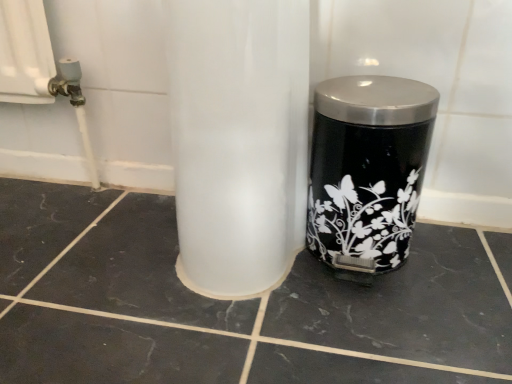
The image size is (512, 384). What do you see at coordinates (367, 171) in the screenshot? I see `black glossy trash can at right` at bounding box center [367, 171].

What is the approximate height of black glossy trash can at right?

black glossy trash can at right is 10.31 inches in height.

Identify the location of black glossy trash can at right. The width and height of the screenshot is (512, 384). (367, 171).

The height and width of the screenshot is (384, 512). What are the coordinates of `black glossy trash can at right` in the screenshot? It's located at (367, 171).